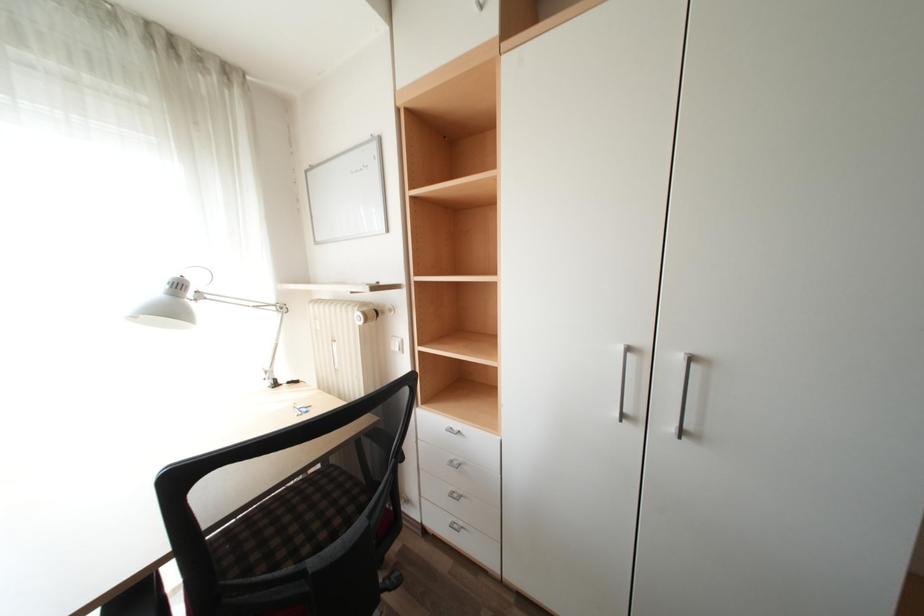
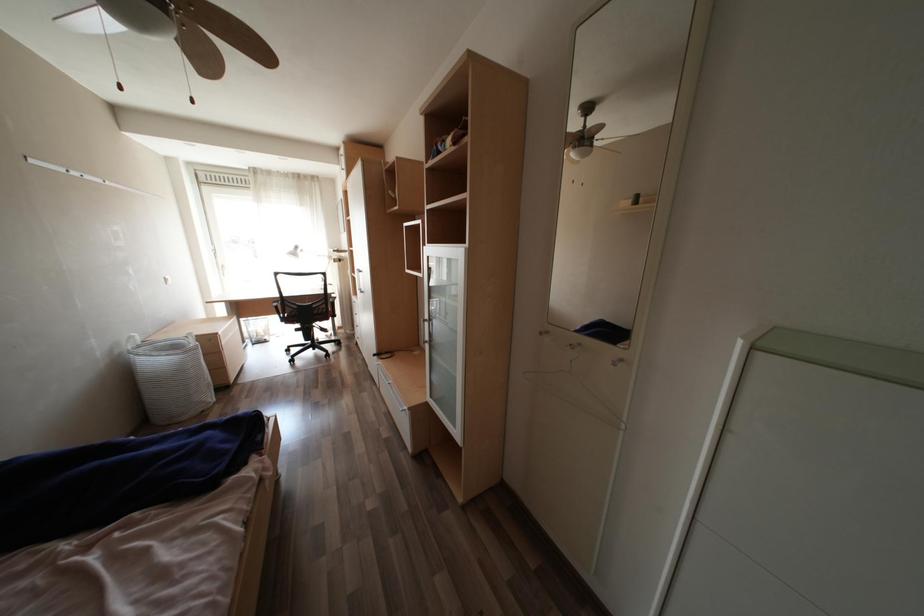
Which direction would the cameraman need to move to produce the second image?

The cameraman moved toward right, backward.